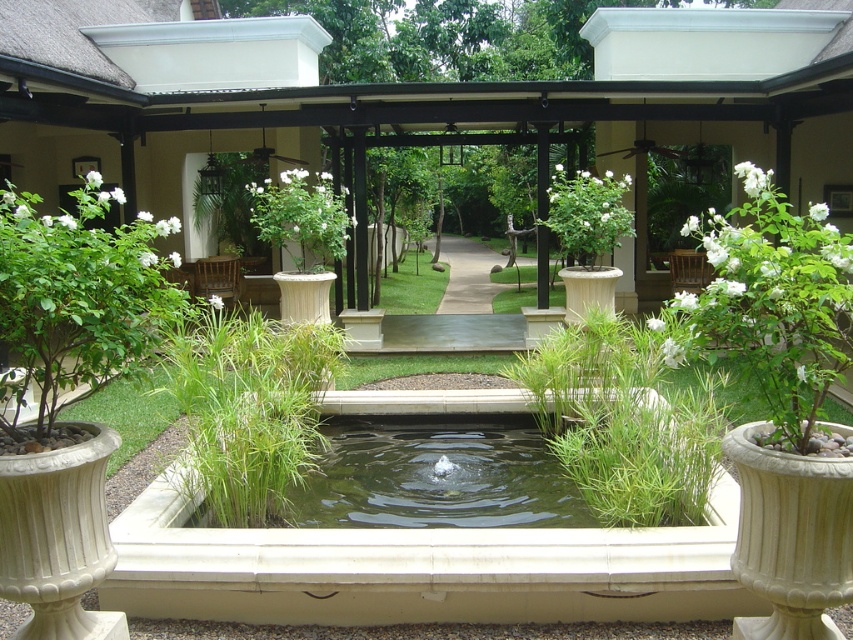
Question: Which is nearer to the white matte vase at center?

Choices:
 (A) green textured pergola at center
 (B) green grassy plant at center
 (C) green grass at center
 (D) white glossy vase at center

Answer: (D)

Question: Does green leafy bush at lower left have a larger size compared to white matte vase at center?

Choices:
 (A) yes
 (B) no

Answer: (B)

Question: Does green textured pergola at center appear on the left side of green grassy plant at center?

Choices:
 (A) no
 (B) yes

Answer: (A)

Question: Among these objects, which one is nearest to the camera?

Choices:
 (A) white matte plant at right
 (B) green grassy plant at center
 (C) green grassy pond at center
 (D) green textured pergola at center

Answer: (A)

Question: Among these objects, which one is farthest from the camera?

Choices:
 (A) white matte plant at right
 (B) white matte vase at center
 (C) green leafy bush at lower left

Answer: (B)

Question: Considering the relative positions of white matte plant at right and white glossy vase at center in the image provided, where is white matte plant at right located with respect to white glossy vase at center?

Choices:
 (A) above
 (B) below

Answer: (B)